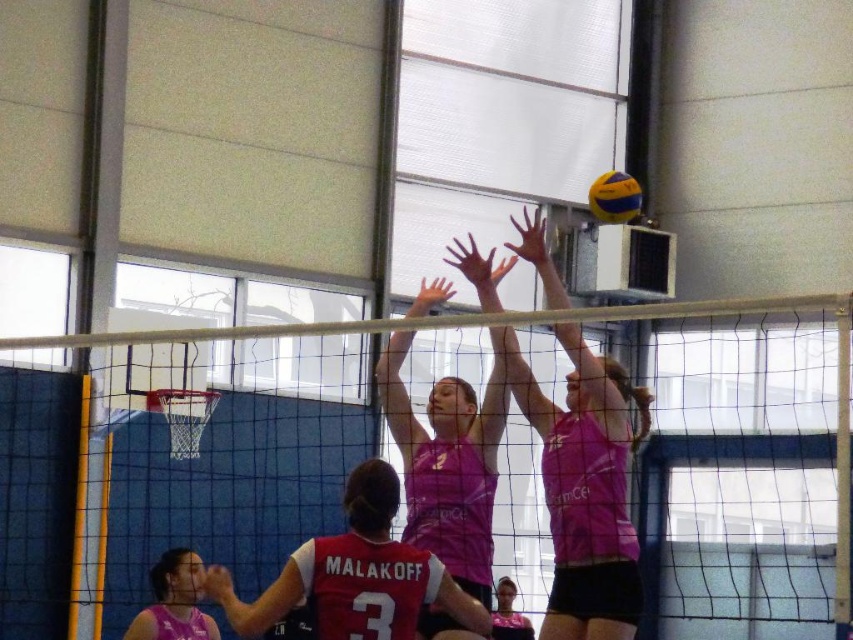
You are standing at the center of the volleyball court and want to throw a ball to the pink fabric shirt at upper center. Which direction should you aim? Please answer with a direction like north, south, east, west, or a combination like northeast.

The pink fabric shirt at upper center is located at coordinates 0.761 on the x axis and 0.686 on the y axis. Since the court is oriented with the net across the frame, the upper center position would be towards the north direction. Therefore, you should aim north to reach the pink fabric shirt at upper center.

You are a photographer positioned at the center of the gymnasium floor. You want to take a photo of the pink fabric shirt at upper center. Based on its 2D location coordinates, where should you aim your camera relative to the center of the image?

The pink fabric shirt at upper center is located at coordinates approximately 0.761 on the x axis and 0.686 on the y axis. Since the center of the image is at 0.5 on both axes, this means the shirt is to the right and above the center of the image. To capture it, aim your camera slightly to the right and upwards from the center point.